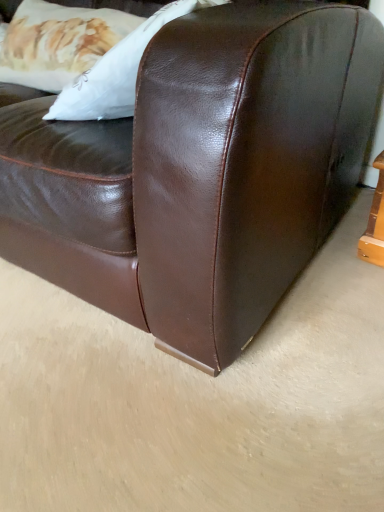
Measure the distance between point (1,46) and camera.

Point (1,46) is 4.44 feet from camera.

Where is `white soft pillow at upper left`? Image resolution: width=384 pixels, height=512 pixels. white soft pillow at upper left is located at coordinates (58, 42).

The width and height of the screenshot is (384, 512). Describe the element at coordinates (58, 42) in the screenshot. I see `white soft pillow at upper left` at that location.

Locate an element on the screen. Image resolution: width=384 pixels, height=512 pixels. white soft pillow at upper left is located at coordinates (58, 42).